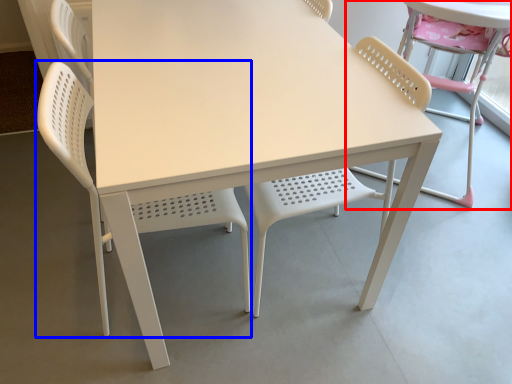
Question: Among these objects, which one is nearest to the camera, chair (highlighted by a red box) or chair (highlighted by a blue box)?

Choices:
 (A) chair
 (B) chair

Answer: (B)